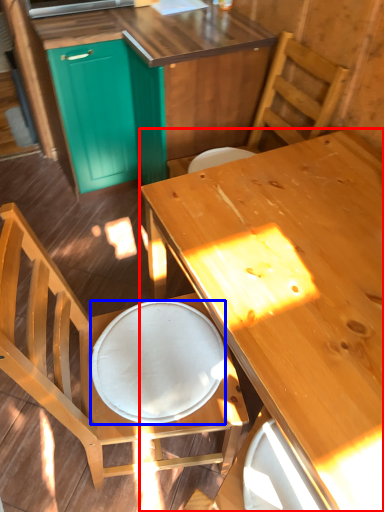
Question: Which of the following is the farthest to the observer, desk (highlighted by a red box) or plate (highlighted by a blue box)?

Choices:
 (A) desk
 (B) plate

Answer: (B)